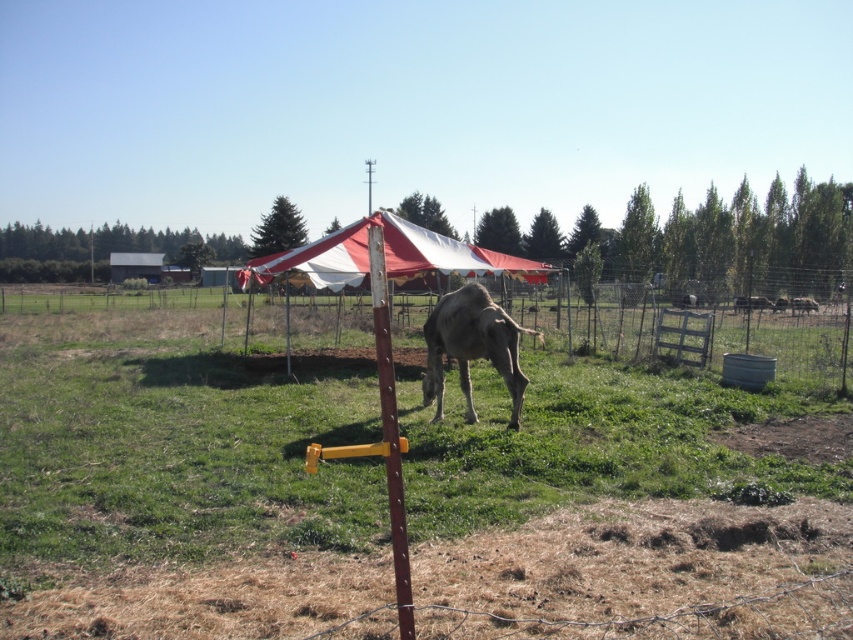
Question: Based on their relative distances, which object is farther from the brown wooden post at center?

Choices:
 (A) gray matte camel at center
 (B) brown fuzzy camel at center
 (C) green grass at center

Answer: (B)

Question: Does red/white fabric canopy at center have a smaller size compared to brown wooden post at center?

Choices:
 (A) yes
 (B) no

Answer: (B)

Question: In this image, where is brown wooden post at center located relative to brown matte cow at center?

Choices:
 (A) below
 (B) above

Answer: (A)

Question: Where is red/white fabric canopy at center located in relation to brown fuzzy camel at center in the image?

Choices:
 (A) above
 (B) below

Answer: (A)

Question: Estimate the real-world distances between objects in this image. Which object is farther from the red/white fabric canopy at center?

Choices:
 (A) brown matte cow at center
 (B) brown wooden post at center
 (C) gray matte camel at center

Answer: (A)

Question: Which point is closer to the camera taking this photo?

Choices:
 (A) (792, 304)
 (B) (752, 308)
 (C) (474, 305)

Answer: (C)